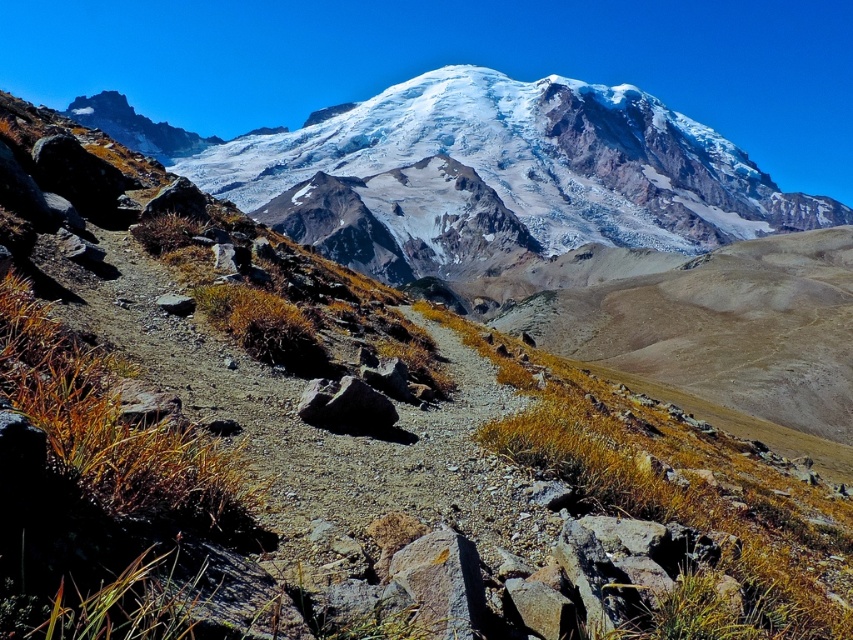
You are a hiker planning to climb the snowy granite mountain at upper center. Your GPS shows that you are currently 731.33 feet away from the base of the mountain. If you start climbing from your current position, will you reach the summit before the sun sets in 3 hours? Assume you can climb at a rate of 200 feet per hour.

The snowy granite mountain at upper center and viewer are 731.33 feet apart from each other. At a climbing rate of 200 feet per hour, it would take approximately 3.66 hours to reach the summit. Since the sun will set in 3 hours, you will not reach the summit before sunset.

You are a hiker planning to take a photo of the snowy granite mountain at upper center. If you want to frame it in the center of your camera viewfinder, where should you position the camera relative to the mountain?

The snowy granite mountain at upper center is already located at the center of the image at point (500, 177), so you should position the camera directly facing the mountain to keep it centered in the viewfinder.